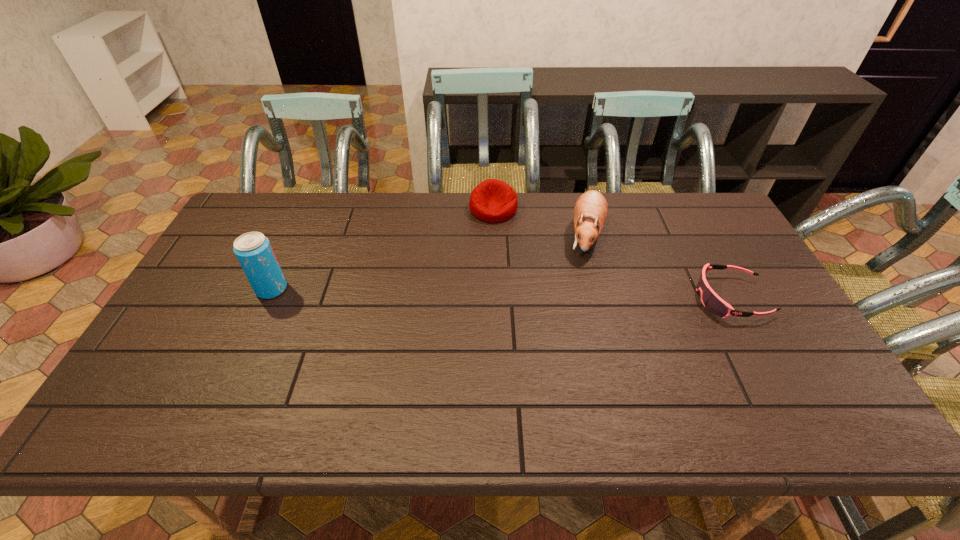
The width and height of the screenshot is (960, 540). I want to click on object situated at the right edge, so click(711, 301).

In the image, there is a desktop. At what (x,y) coordinates should I click in order to perform the action: click on free region at the far edge. Please return your answer as a coordinate pair (x, y). Looking at the image, I should click on (333, 219).

This screenshot has height=540, width=960. In the image, there is a desktop. What are the coordinates of `vacant space at the near edge` in the screenshot? It's located at (457, 392).

Image resolution: width=960 pixels, height=540 pixels. Find the location of `free region at the left edge of the desktop`. free region at the left edge of the desktop is located at coordinates [x=213, y=301].

At what (x,y) coordinates should I click in order to perform the action: click on vacant space at the right edge of the desktop. Please return your answer as a coordinate pair (x, y). This screenshot has width=960, height=540. Looking at the image, I should click on (690, 245).

Locate an element on the screen. The width and height of the screenshot is (960, 540). free location at the far left corner is located at coordinates (270, 197).

The width and height of the screenshot is (960, 540). Identify the location of blank area at the far right corner. 679,211.

This screenshot has width=960, height=540. In order to click on free spot between the goggles and the soda can in this screenshot , I will do `click(501, 294)`.

Find the location of `free point between the shortest object and the leftmost object`. free point between the shortest object and the leftmost object is located at coordinates (x=501, y=294).

The height and width of the screenshot is (540, 960). I want to click on empty location between the shortest object and the soda can, so click(501, 294).